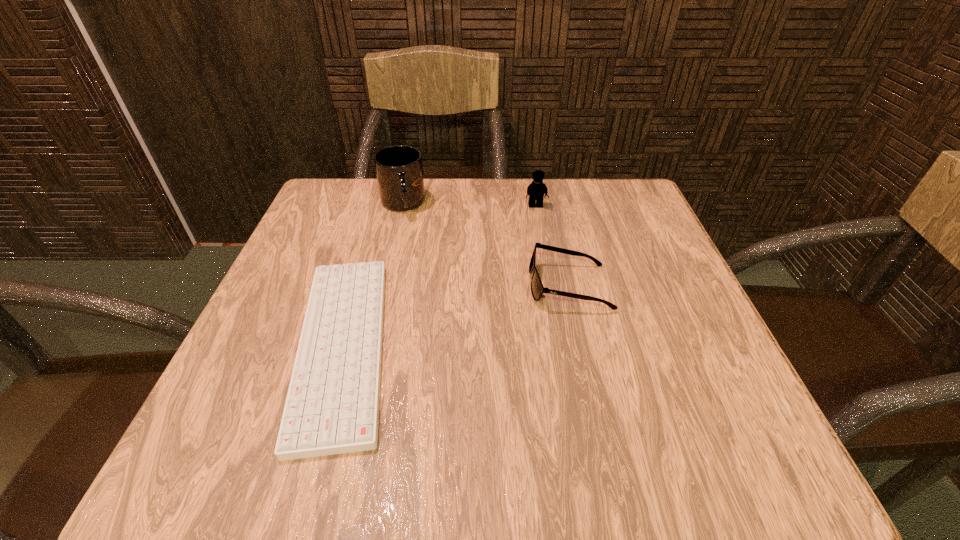
Identify the location of mug that is positioned at the far edge. (399, 171).

The height and width of the screenshot is (540, 960). I want to click on Lego that is at the far edge, so click(537, 189).

The image size is (960, 540). I want to click on object located in the near edge section of the desktop, so click(332, 407).

The height and width of the screenshot is (540, 960). I want to click on mug that is at the left edge, so click(399, 171).

This screenshot has height=540, width=960. I want to click on computer keyboard situated at the left edge, so click(x=332, y=407).

At what (x,y) coordinates should I click in order to perform the action: click on object that is at the right edge. Please return your answer as a coordinate pair (x, y). Looking at the image, I should click on (537, 289).

Where is `object present at the far left corner`? object present at the far left corner is located at coordinates (399, 171).

The image size is (960, 540). I want to click on object at the near left corner, so click(332, 407).

In the image, there is a desktop. At what (x,y) coordinates should I click in order to perform the action: click on vacant region at the far edge. Please return your answer as a coordinate pair (x, y). The width and height of the screenshot is (960, 540). Looking at the image, I should click on (407, 215).

Identify the location of vacant space at the near edge. The image size is (960, 540). (542, 417).